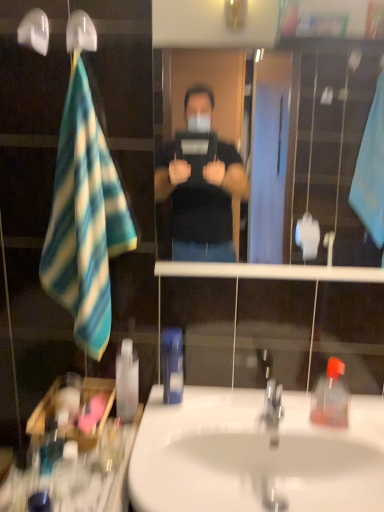
Question: Relative to translucent plastic mouthwash at lower left, placed as the third mouthwash when sorted from front to back, is clear glass mirror at center in front or behind?

Choices:
 (A) behind
 (B) front

Answer: (B)

Question: Looking at their shapes, would you say clear glass mirror at center is wider or thinner than translucent plastic mouthwash at lower left, which is counted as the 2th mouthwash, starting from the right?

Choices:
 (A) thin
 (B) wide

Answer: (A)

Question: Based on their relative distances, which object is farther from the translucent plastic mouthwash at lower left, positioned as the 1th mouthwash in front-to-back order?

Choices:
 (A) translucent plastic mouthwash at lower left, which is counted as the 2th mouthwash, starting from the right
 (B) blue and white striped towel at left
 (C) blue plastic mouthwash at center, marked as the first mouthwash in a right-to-left arrangement
 (D) white plastic shower head at upper left
 (E) translucent plastic soap dispenser at right

Answer: (D)

Question: Which is nearer to the translucent plastic soap dispenser at right?

Choices:
 (A) blue and white striped towel at left
 (B) translucent plastic mouthwash at lower left, which is the 1th mouthwash from back to front
 (C) translucent plastic mouthwash at lower left, positioned as the 1th mouthwash in front-to-back order
 (D) blue plastic mouthwash at center, marked as the first mouthwash in a right-to-left arrangement
 (E) white plastic shower head at upper left

Answer: (D)